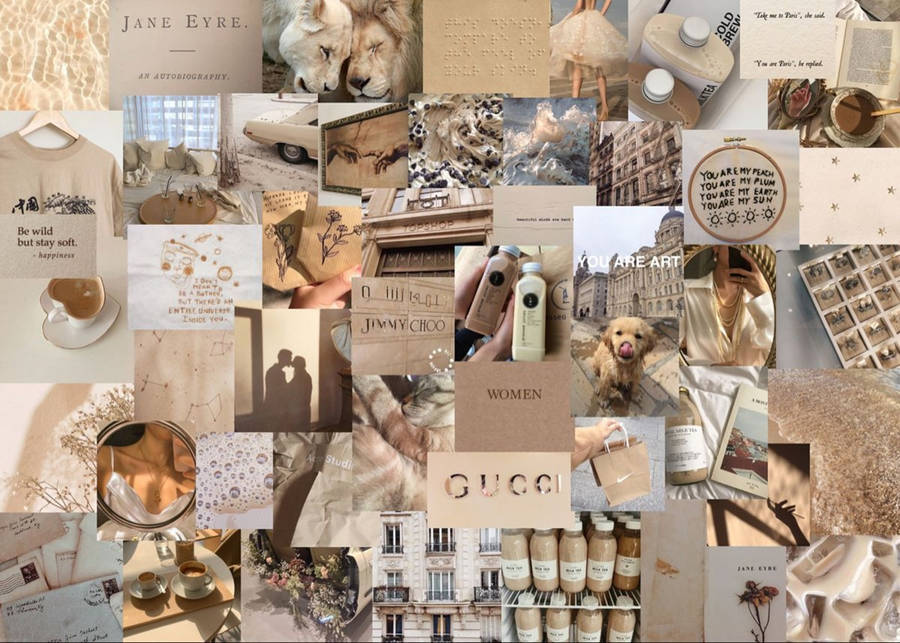
Find the location of a particular element. This screenshot has height=643, width=900. windows is located at coordinates (388, 539), (436, 539), (496, 538), (490, 582), (451, 580), (394, 577), (394, 622), (435, 622), (490, 625).